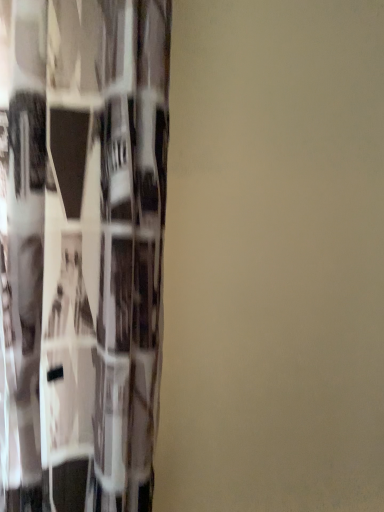
What do you see at coordinates (82, 251) in the screenshot? I see `white sheer fabric at left` at bounding box center [82, 251].

What is the approximate height of white sheer fabric at left?

The height of white sheer fabric at left is 3.82 feet.

Locate an element on the screen. This screenshot has width=384, height=512. white sheer fabric at left is located at coordinates (82, 251).

I want to click on white sheer fabric at left, so click(x=82, y=251).